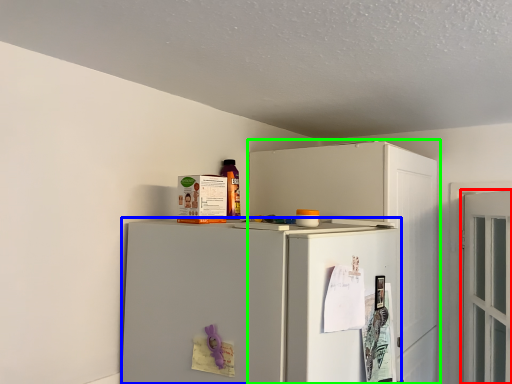
Question: Which object is the farthest from door (highlighted by a red box)? Choose among these: refrigerator (highlighted by a blue box) or cabinetry (highlighted by a green box).

Choices:
 (A) refrigerator
 (B) cabinetry

Answer: (A)